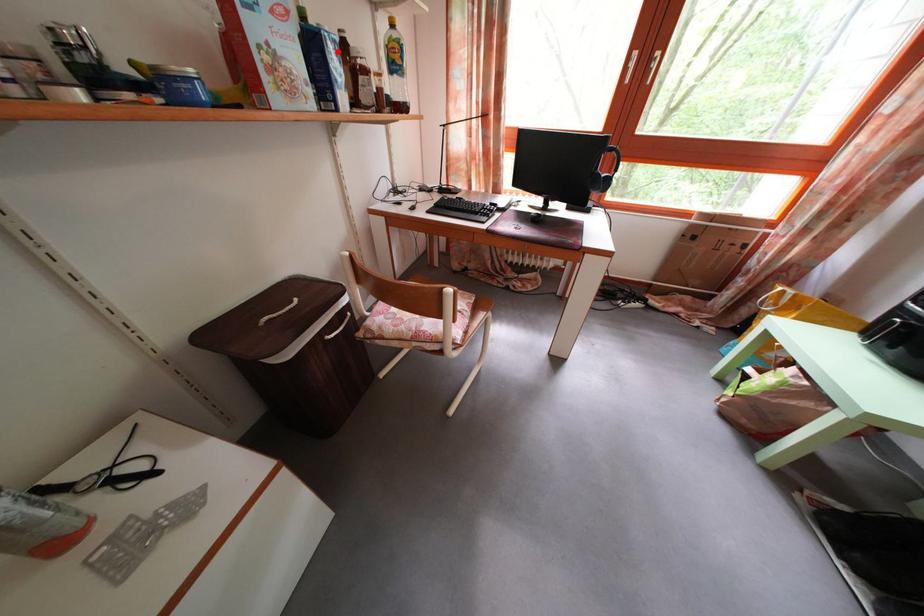
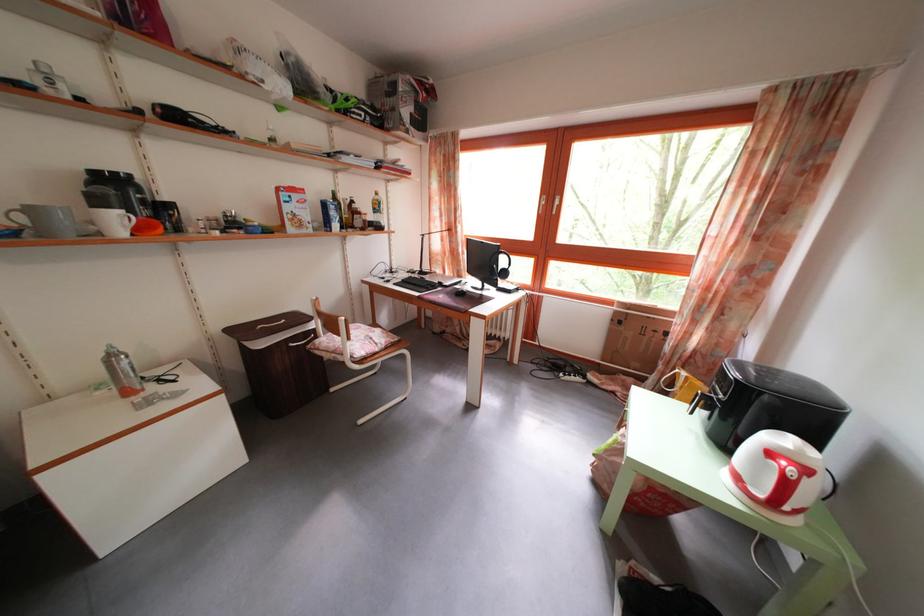
Locate, in the second image, the point that corresponds to the highlighted location in the first image.

(338, 214)